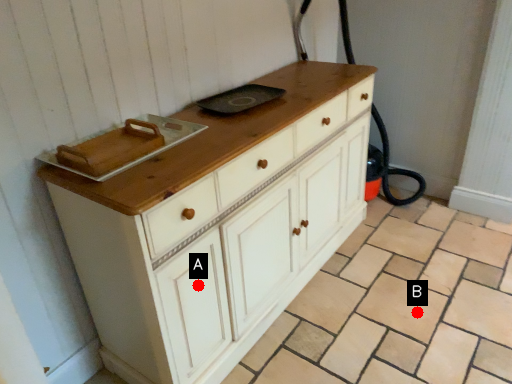
Question: Two points are circled on the image, labeled by A and B beside each circle. Among these points, which one is farthest from the camera?

Choices:
 (A) A is further
 (B) B is further

Answer: (B)